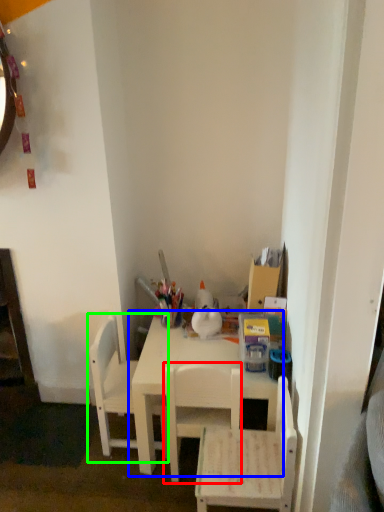
Question: Estimate the real-world distances between objects in this image. Which object is closer to chair (highlighted by a red box), table (highlighted by a blue box) or chair (highlighted by a green box)?

Choices:
 (A) table
 (B) chair

Answer: (A)